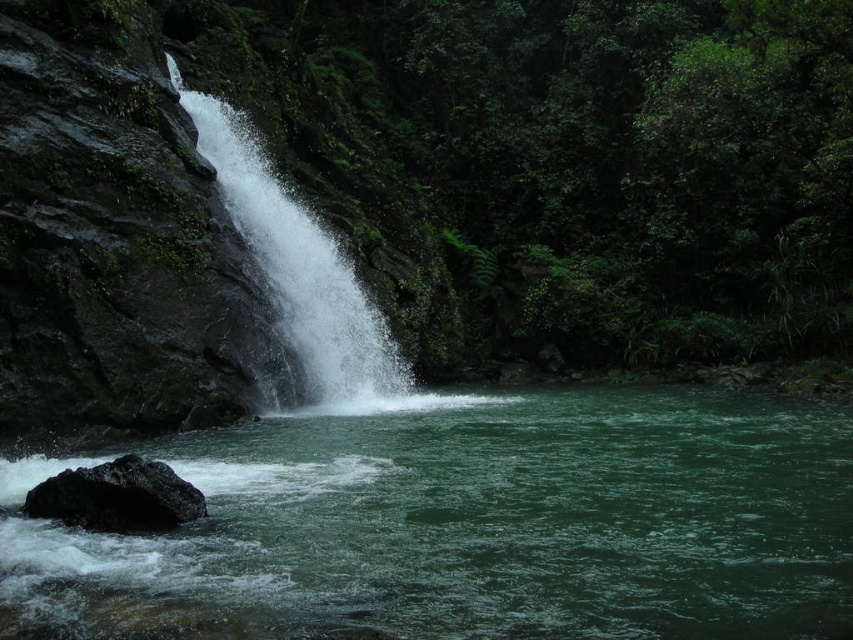
Question: Is green liquid at center bigger than white frothy water at center?

Choices:
 (A) yes
 (B) no

Answer: (B)

Question: Does white frothy water at center have a greater width compared to black rough rock at lower left?

Choices:
 (A) no
 (B) yes

Answer: (B)

Question: Which object is the farthest from the white frothy water at center?

Choices:
 (A) black rough rock at lower left
 (B) green liquid at center

Answer: (A)

Question: Based on their relative distances, which object is nearer to the green liquid at center?

Choices:
 (A) black rough rock at lower left
 (B) white frothy water at center

Answer: (A)

Question: Can you confirm if green liquid at center is wider than white frothy water at center?

Choices:
 (A) no
 (B) yes

Answer: (B)

Question: Based on their relative distances, which object is nearer to the black rough rock at lower left?

Choices:
 (A) green liquid at center
 (B) white frothy water at center

Answer: (A)